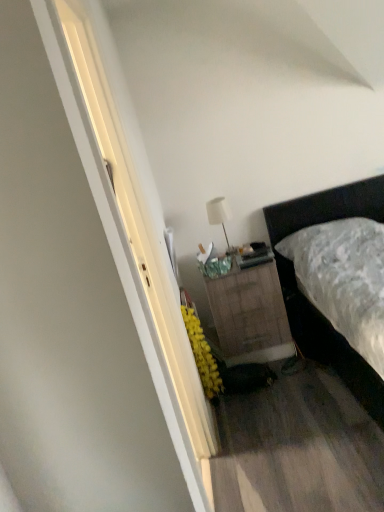
Question: From a real-world perspective, is dark brown leather bed at right physically below white matte table lamp at upper center?

Choices:
 (A) yes
 (B) no

Answer: (A)

Question: Is white matte table lamp at upper center located within dark brown leather bed at right?

Choices:
 (A) no
 (B) yes

Answer: (A)

Question: Is dark brown leather bed at right at the left side of white matte table lamp at upper center?

Choices:
 (A) yes
 (B) no

Answer: (B)

Question: Is dark brown leather bed at right touching white matte table lamp at upper center?

Choices:
 (A) no
 (B) yes

Answer: (A)

Question: Is dark brown leather bed at right positioned far away from white matte table lamp at upper center?

Choices:
 (A) no
 (B) yes

Answer: (A)

Question: Is dark brown leather bed at right located outside white matte table lamp at upper center?

Choices:
 (A) yes
 (B) no

Answer: (A)

Question: Is white matte table lamp at upper center at the left side of dark brown leather bed at right?

Choices:
 (A) no
 (B) yes

Answer: (B)

Question: Is white matte table lamp at upper center located outside dark brown leather bed at right?

Choices:
 (A) yes
 (B) no

Answer: (A)

Question: Is white matte table lamp at upper center far away from dark brown leather bed at right?

Choices:
 (A) no
 (B) yes

Answer: (A)

Question: Does white matte table lamp at upper center have a lesser height compared to dark brown leather bed at right?

Choices:
 (A) no
 (B) yes

Answer: (B)

Question: Is white matte table lamp at upper center to the right of dark brown leather bed at right from the viewer's perspective?

Choices:
 (A) yes
 (B) no

Answer: (B)

Question: From the image's perspective, is white matte table lamp at upper center above dark brown leather bed at right?

Choices:
 (A) no
 (B) yes

Answer: (B)

Question: Is dark brown leather bed at right thinner than burlap-textured nightstand at center?

Choices:
 (A) yes
 (B) no

Answer: (B)